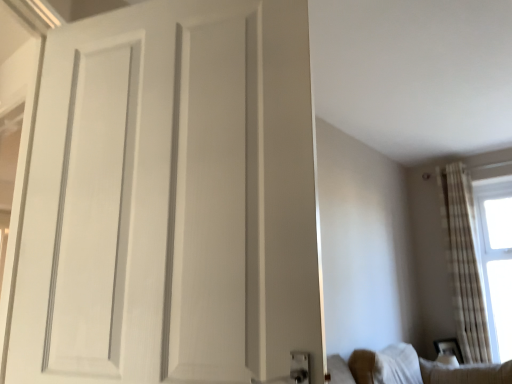
Question: Is white matte door at center at the right side of white fabric couch at lower right?

Choices:
 (A) yes
 (B) no

Answer: (B)

Question: Considering the relative positions of white matte door at center and white fabric couch at lower right in the image provided, is white matte door at center to the left of white fabric couch at lower right from the viewer's perspective?

Choices:
 (A) yes
 (B) no

Answer: (A)

Question: From the image's perspective, is white matte door at center beneath white fabric couch at lower right?

Choices:
 (A) no
 (B) yes

Answer: (A)

Question: Can you confirm if white matte door at center is shorter than white fabric couch at lower right?

Choices:
 (A) no
 (B) yes

Answer: (A)

Question: Is white matte door at center taller than white fabric couch at lower right?

Choices:
 (A) no
 (B) yes

Answer: (B)

Question: Considering the positions of point (479, 321) and point (502, 284), is point (479, 321) closer or farther from the camera than point (502, 284)?

Choices:
 (A) farther
 (B) closer

Answer: (B)

Question: In terms of height, does white sheer curtains at right look taller or shorter compared to white sheer curtain at right?

Choices:
 (A) short
 (B) tall

Answer: (B)

Question: From a real-world perspective, is white sheer curtains at right physically located above or below white sheer curtain at right?

Choices:
 (A) above
 (B) below

Answer: (A)

Question: Is white sheer curtains at right inside the boundaries of white sheer curtain at right, or outside?

Choices:
 (A) outside
 (B) inside

Answer: (A)

Question: Relative to white sheer curtains at right, is white sheer curtain at right in front or behind?

Choices:
 (A) behind
 (B) front

Answer: (A)

Question: From a real-world perspective, is white sheer curtain at right above or below white sheer curtains at right?

Choices:
 (A) above
 (B) below

Answer: (B)

Question: From the image's perspective, is white sheer curtain at right above or below white sheer curtains at right?

Choices:
 (A) above
 (B) below

Answer: (B)

Question: Looking at the image, does white sheer curtain at right seem bigger or smaller compared to white sheer curtains at right?

Choices:
 (A) small
 (B) big

Answer: (A)

Question: From a real-world perspective, is white fabric couch at lower right above or below white sheer curtain at right?

Choices:
 (A) above
 (B) below

Answer: (B)

Question: Looking at the image, does white fabric couch at lower right seem bigger or smaller compared to white sheer curtain at right?

Choices:
 (A) big
 (B) small

Answer: (B)